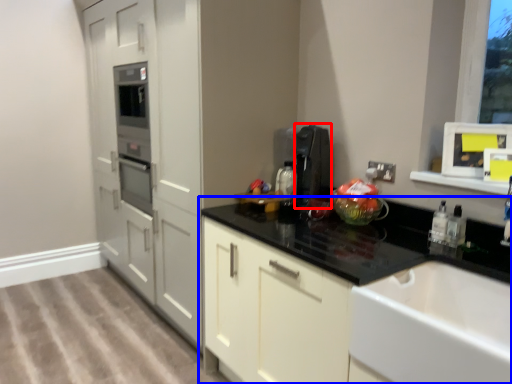
Question: Which object appears closest to the camera in this image, appliance (highlighted by a red box) or countertop (highlighted by a blue box)?

Choices:
 (A) appliance
 (B) countertop

Answer: (B)